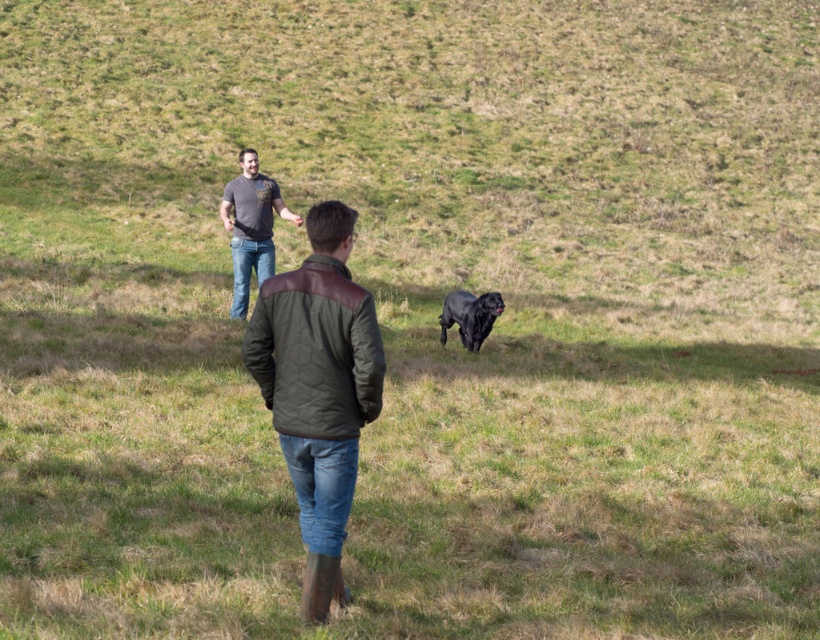
In the scene shown: Who is more distant from viewer, (287,326) or (278,211)?

The point (278,211) is behind.

Image resolution: width=820 pixels, height=640 pixels. I want to click on dark green quilted jacket at center, so click(317, 388).

Can you confirm if matte gray t-shirt at upper left is shorter than black matte dog at center?

No, matte gray t-shirt at upper left is not shorter than black matte dog at center.

Who is more distant from viewer, (290,216) or (440,340)?

Point (440,340)

The width and height of the screenshot is (820, 640). What are the coordinates of `matte gray t-shirt at upper left` in the screenshot? It's located at (251, 227).

Does dark green quilted jacket at center lie in front of black matte dog at center?

That is True.

Is point (283, 440) more distant than point (454, 307)?

No.

Between point (258, 346) and point (490, 294), which one is positioned in front?

Point (258, 346) is in front.

Identify the location of dark green quilted jacket at center. This screenshot has height=640, width=820. click(x=317, y=388).